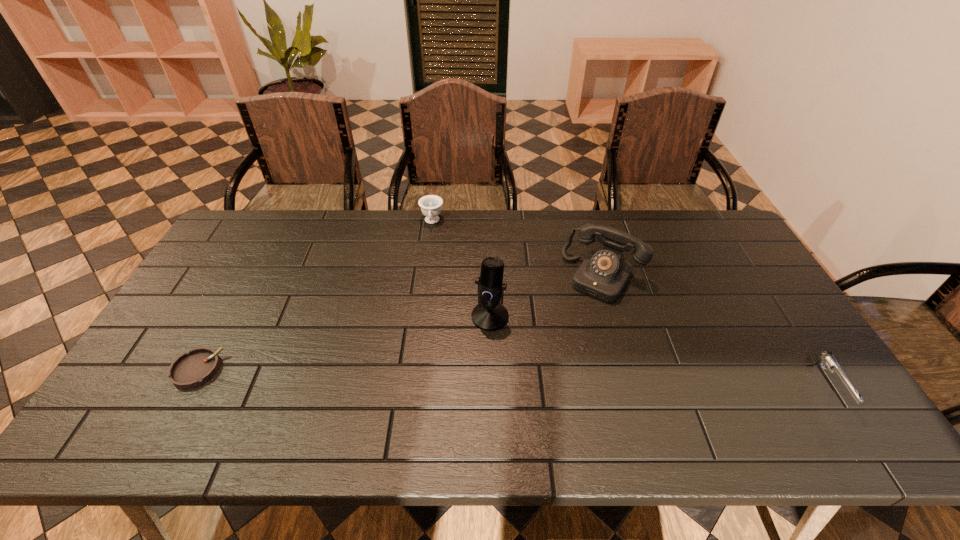
You are a GUI agent. You are given a task and a screenshot of the screen. Output one action in this format:
    pyautogui.click(x=<x>, y=<y>)
    Task: Click on the teacup at the far edge
    
    Given the screenshot: What is the action you would take?
    pyautogui.click(x=430, y=205)

Locate an element on the screen. The width and height of the screenshot is (960, 540). ashtray located at the near edge is located at coordinates (195, 368).

The image size is (960, 540). I want to click on pistol that is at the near edge, so [x=821, y=357].

Locate an element on the screen. This screenshot has height=540, width=960. object that is at the left edge is located at coordinates (195, 368).

Identify the location of object that is at the right edge. (821, 357).

The image size is (960, 540). I want to click on object that is positioned at the near left corner, so click(x=195, y=368).

At what (x,y) coordinates should I click in order to perform the action: click on object that is at the near right corner. Please return your answer as a coordinate pair (x, y). This screenshot has height=540, width=960. Looking at the image, I should click on pyautogui.click(x=821, y=357).

I want to click on free space at the far edge of the desktop, so click(383, 233).

Identify the location of free location at the near edge of the desktop. This screenshot has width=960, height=540. (338, 386).

Identify the location of free space at the left edge of the desktop. The image size is (960, 540). (237, 305).